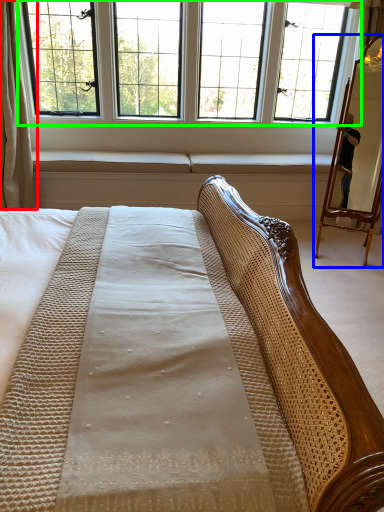
Question: Considering the real-world distances, which object is closest to curtain (highlighted by a red box)? mirror (highlighted by a blue box) or window (highlighted by a green box).

Choices:
 (A) mirror
 (B) window

Answer: (B)